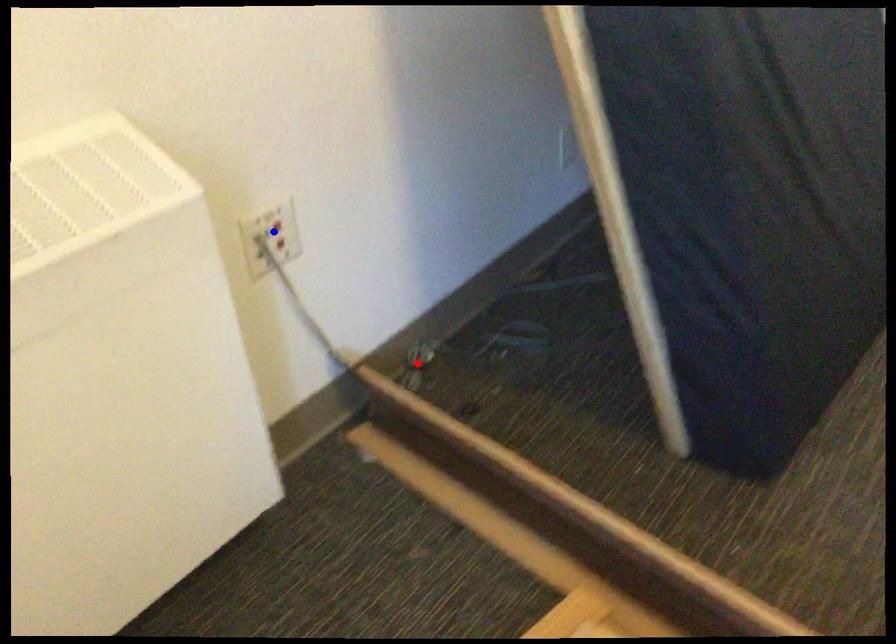
Question: Two points are marked on the image. Which point is closer to the camera?

Choices:
 (A) Blue point is closer.
 (B) Red point is closer.

Answer: (A)